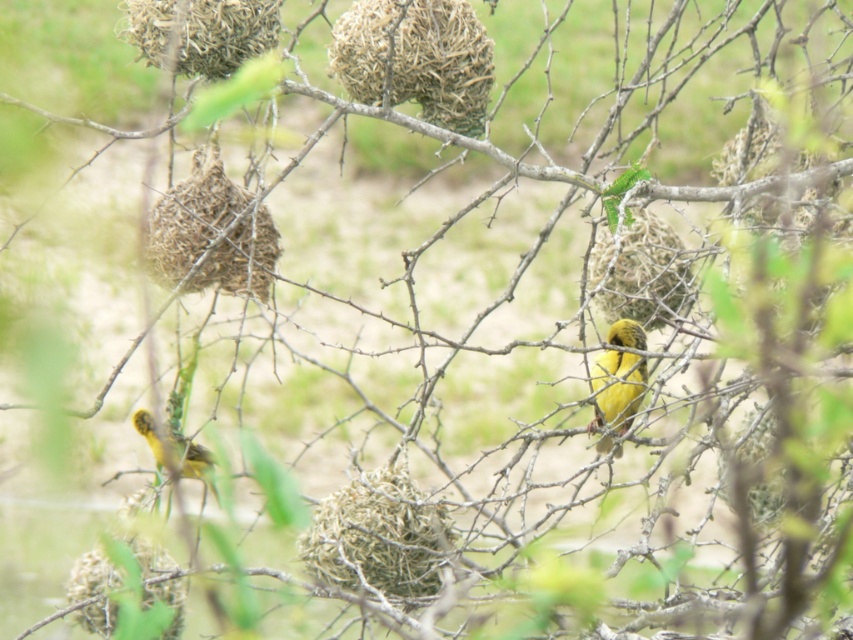
You are a birdwatcher observing the nests in the scene. You notice the brown textured nest at upper center and the green textured nest at center. Which nest has a greater width?

The brown textured nest at upper center has a greater width than the green textured nest at center.

You are a birdwatcher observing the scene. You notice the brown woven nest at upper left and the yellow matte bird at center. From your vantage point, which object is positioned to the left of the other?

The brown woven nest at upper left is to the left of the yellow matte bird at center.

You are a birdwatcher holding a 36 inch long pole. You want to reach the yellow matte bird at center from the brown textured nest at upper center. Can you do it with your pole?

The distance between the brown textured nest at upper center and the yellow matte bird at center is 37.72 inches. Since your pole is only 36 inches long, it is not long enough to reach the bird from the nest.